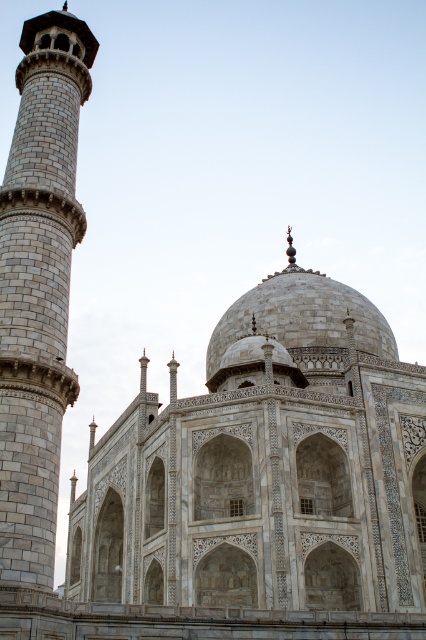
Question: Can you confirm if white marble tower at left is positioned to the left of white marble dome at center?

Choices:
 (A) no
 (B) yes

Answer: (B)

Question: Can you confirm if white marble tower at left is positioned to the left of white marble dome at center?

Choices:
 (A) yes
 (B) no

Answer: (A)

Question: Which object is farther from the camera taking this photo?

Choices:
 (A) white marble dome at center
 (B) white marble tower at left

Answer: (A)

Question: Is the position of white marble tower at left less distant than that of white marble dome at center?

Choices:
 (A) yes
 (B) no

Answer: (A)